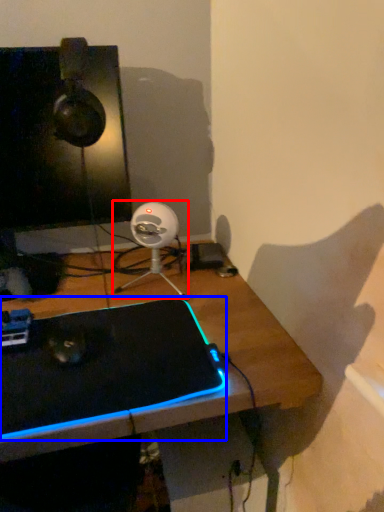
Question: Which object appears farthest to the camera in this image, fan (highlighted by a red box) or laptop (highlighted by a blue box)?

Choices:
 (A) fan
 (B) laptop

Answer: (A)